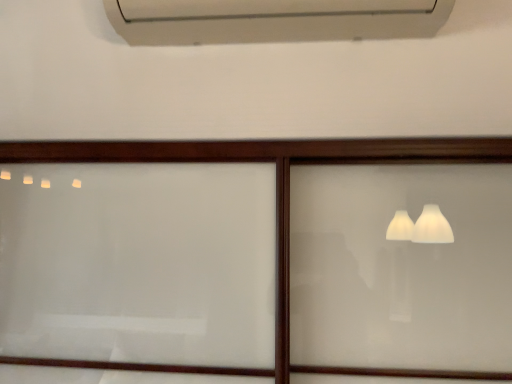
The image size is (512, 384). What do you see at coordinates (273, 20) in the screenshot?
I see `white matte air conditioner at upper center` at bounding box center [273, 20].

In order to click on white matte air conditioner at upper center in this screenshot , I will do `click(273, 20)`.

Identify the location of white matte air conditioner at upper center. The image size is (512, 384). (273, 20).